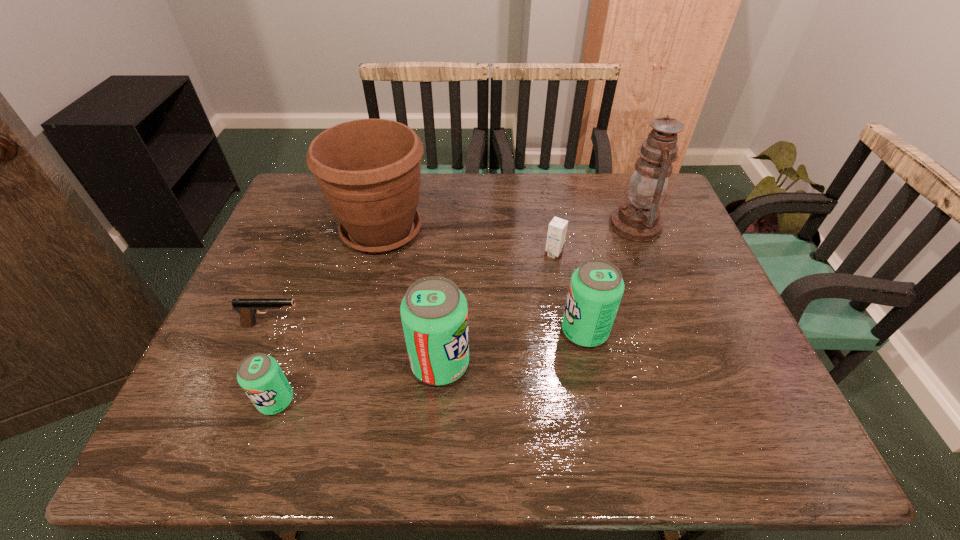
Where is `vacant spot to place a pop soda on the right`? vacant spot to place a pop soda on the right is located at coordinates (712, 302).